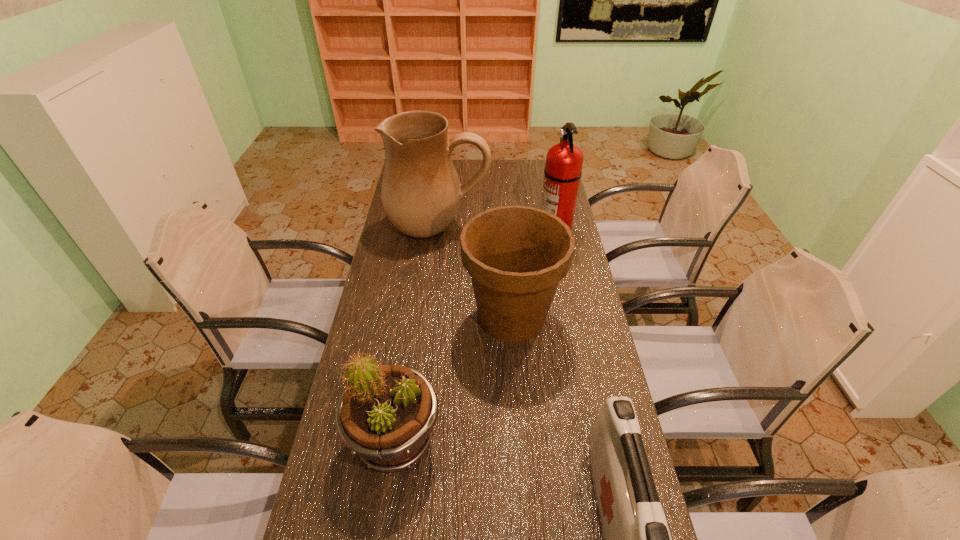
Locate an element on the screen. This screenshot has width=960, height=540. vacant region located 0.070m on the back of the nearer flowerpot is located at coordinates (405, 380).

What are the coordinates of `cream pitcher that is at the left edge` in the screenshot? It's located at (421, 192).

The image size is (960, 540). I want to click on flowerpot at the left edge, so click(386, 416).

Locate an element on the screen. This screenshot has width=960, height=540. fire extinguisher located in the right edge section of the desktop is located at coordinates (564, 161).

Locate an element on the screen. The image size is (960, 540). flowerpot located in the right edge section of the desktop is located at coordinates (516, 255).

Locate an element on the screen. blank space at the far edge of the desktop is located at coordinates (457, 171).

Locate an element on the screen. The image size is (960, 540). vacant space at the left edge of the desktop is located at coordinates (389, 347).

Locate an element on the screen. Image resolution: width=960 pixels, height=540 pixels. vacant area at the right edge of the desktop is located at coordinates [x=588, y=503].

The height and width of the screenshot is (540, 960). I want to click on vacant point located between the nearer flowerpot and the fire extinguisher, so click(475, 335).

What are the coordinates of `vacant space in between the cream pitcher and the left flowerpot` in the screenshot? It's located at coord(418,334).